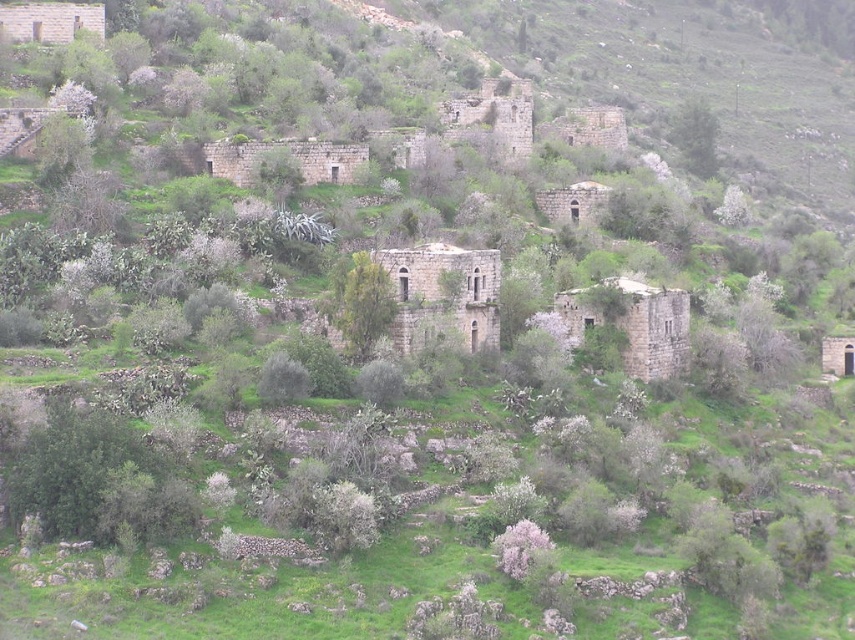
You are a hiker who wants to take a photo of the green leafy tree at center and the green leafy tree at upper right. Which tree should you stand closer to in order to capture both trees in the same frame?

You should stand closer to the green leafy tree at center because it is shorter than the green leafy tree at upper right, allowing both to fit within the camera frame when positioned appropriately.

You are standing in the rural landscape scene and want to walk from the point closer to you to the farther point. Which path would you take between the point at coordinates point (348, 340) and the point at coordinates point (717, 129)?

The path from point (348, 340) to point (717, 129) requires moving towards the upper right direction since point (348, 340) is closer to the viewer and point (717, 129) is farther away.